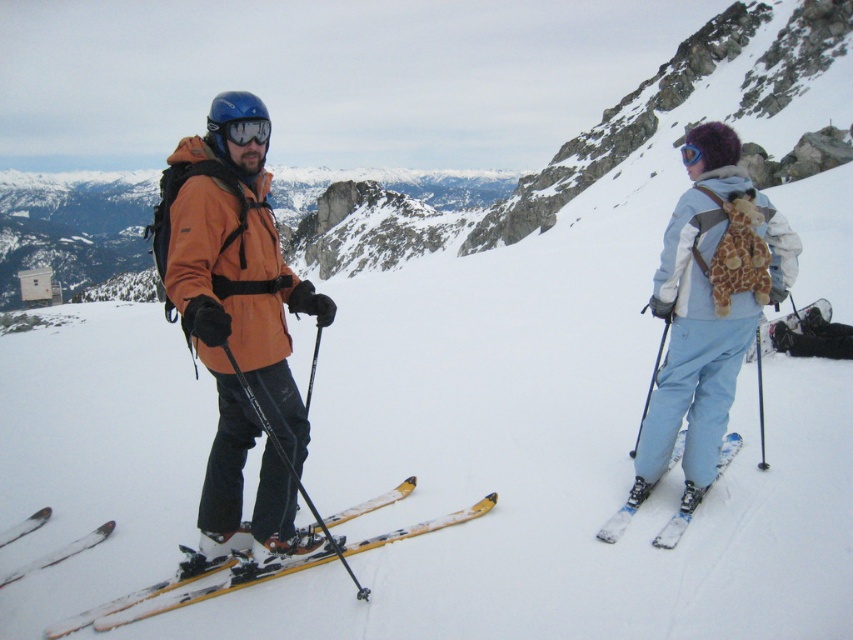
Question: Which object is the farthest from the yellow matte skis at center?

Choices:
 (A) white matte ski at lower right
 (B) orange softshell jacket at left

Answer: (B)

Question: Can you confirm if orange softshell jacket at left is positioned to the left of light blue fabric ski suit at right?

Choices:
 (A) no
 (B) yes

Answer: (A)

Question: Observing the image, what is the correct spatial positioning of white matte ski at lower right in reference to transparent blue goggles at upper center?

Choices:
 (A) above
 (B) below

Answer: (B)

Question: Which of the following is the farthest from the observer?

Choices:
 (A) light blue fabric ski suit at right
 (B) matte orange jacket at center

Answer: (A)

Question: Is orange softshell jacket at left thinner than yellow metallic skis at lower left?

Choices:
 (A) no
 (B) yes

Answer: (A)

Question: Among these objects, which one is nearest to the camera?

Choices:
 (A) matte orange jacket at center
 (B) yellow matte skis at center
 (C) blue matte goggles at center
 (D) light blue fabric ski suit at right

Answer: (B)